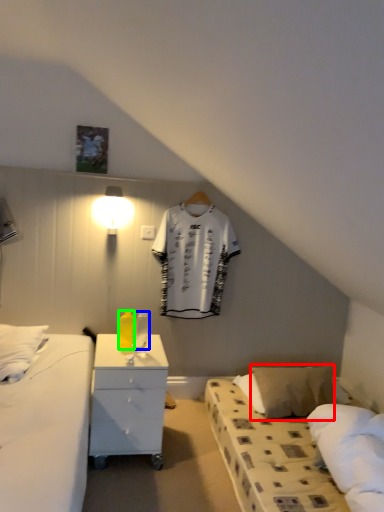
Question: Which object is the closest to the pillow (highlighted by a red box)? Choose among these: bottle (highlighted by a blue box) or bottle (highlighted by a green box).

Choices:
 (A) bottle
 (B) bottle

Answer: (A)